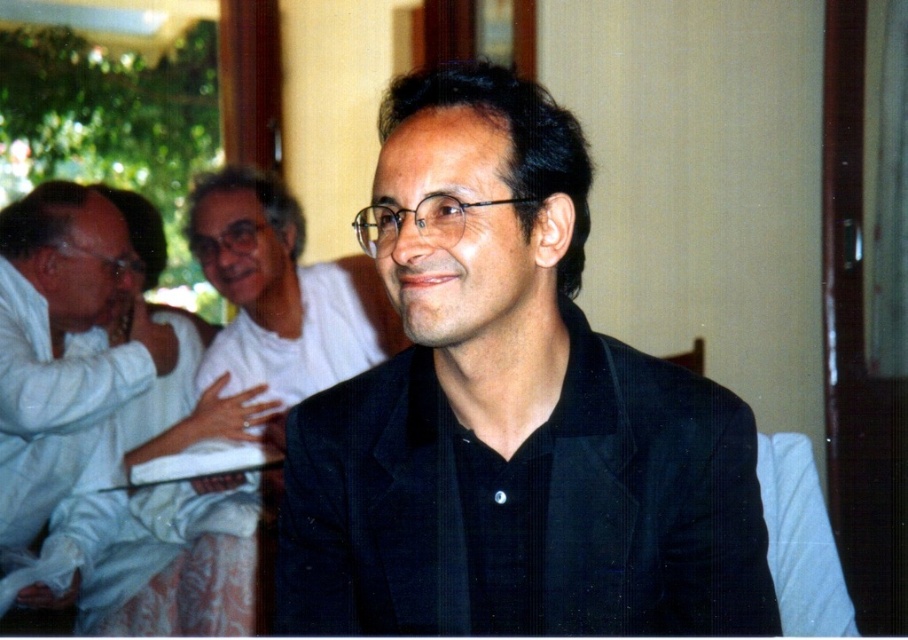
You are a photographer who needs to adjust the lighting to ensure both the black textured suit at center and the white cotton shirt at left are evenly lit. Based on their positions, which side of the scene should you increase the light intensity?

The black textured suit at center is to the right of the white cotton shirt at left. To evenly light both, you should increase the light intensity on the right side of the scene where the black textured suit at center is located, as darker colors absorb more light and may require additional illumination.

In the scene shown: You are a photographer setting up for a group photo. You need to ensure that the black textured suit at center and the white cotton shirt at left are both visible in the frame. Based on their positions, which item is covering part of the other?

The black textured suit at center is positioned over the white cotton shirt at left, so it is covering part of the white cotton shirt at left.